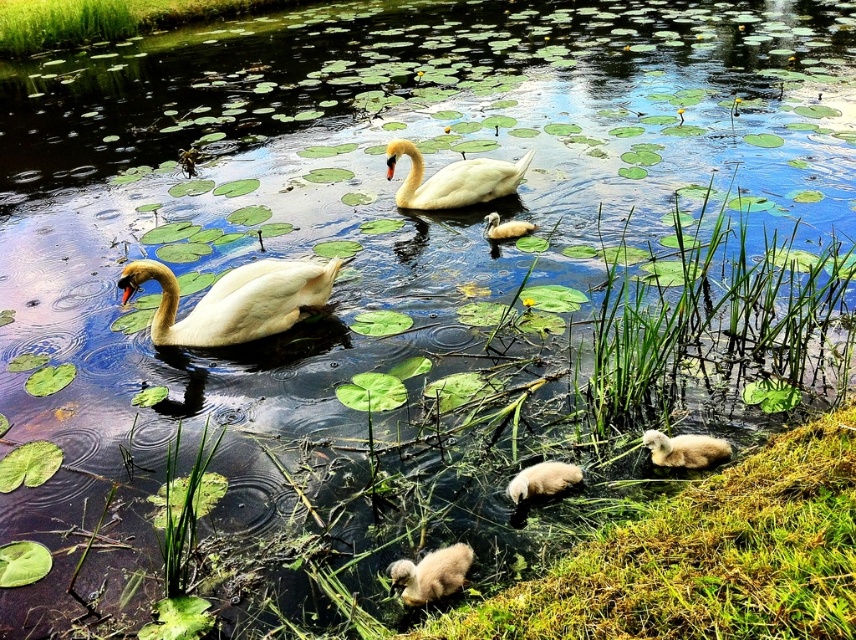
Can you confirm if white glossy swan at left is smaller than white glossy swan at center?

Yes, white glossy swan at left is smaller than white glossy swan at center.

Can you confirm if white glossy swan at left is positioned to the left of white glossy swan at center?

Correct, you'll find white glossy swan at left to the left of white glossy swan at center.

Who is more forward, (316, 275) or (477, 188)?

Point (316, 275)

I want to click on white glossy swan at left, so 233,300.

Which of these two, soft yellow duckling at lower right or soft yellow duckling at center, stands shorter?

soft yellow duckling at lower right

Which is above, soft yellow duckling at lower right or soft yellow duckling at center?

soft yellow duckling at center

Who is more distant from viewer, (x=688, y=456) or (x=486, y=216)?

Point (x=486, y=216)

Locate an element on the screen. Image resolution: width=856 pixels, height=640 pixels. soft yellow duckling at lower right is located at coordinates (684, 449).

Between point (432, 561) and point (527, 492), which one is positioned in front?

Point (432, 561) is more forward.

Is fluffy beige duckling at lower center to the right of fluffy white duckling at lower center from the viewer's perspective?

In fact, fluffy beige duckling at lower center is to the left of fluffy white duckling at lower center.

Where is `fluffy beige duckling at lower center`? Image resolution: width=856 pixels, height=640 pixels. fluffy beige duckling at lower center is located at coordinates (431, 573).